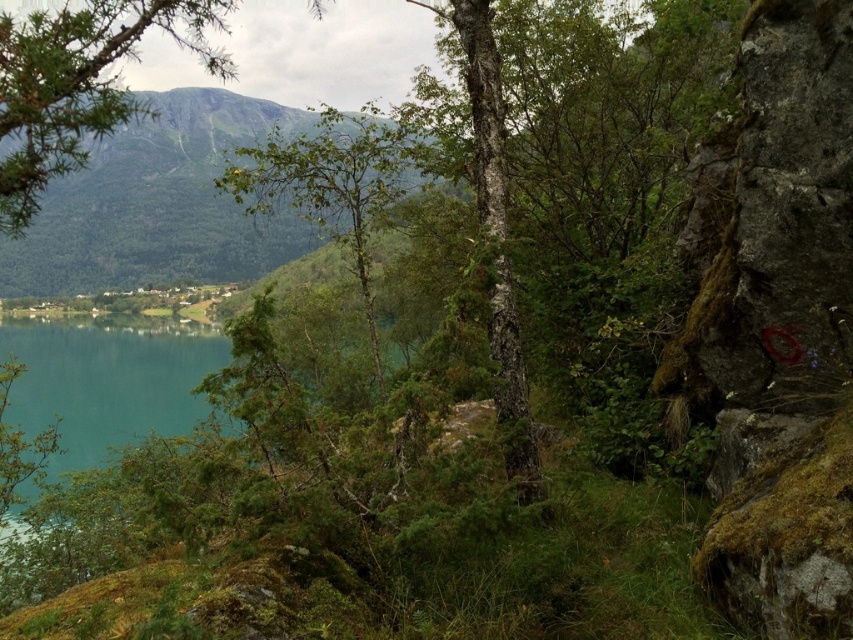
Question: Which point is closer to the camera taking this photo?

Choices:
 (A) (276, 186)
 (B) (112, 272)
 (C) (840, 173)

Answer: (C)

Question: Can you confirm if mossy rock at right is positioned below green leafy tree at center?

Choices:
 (A) no
 (B) yes

Answer: (B)

Question: Which object is closer to the camera taking this photo?

Choices:
 (A) green needle-like leaves at upper left
 (B) green textured mountain at upper left

Answer: (A)

Question: Does green needle-like leaves at upper left have a larger size compared to green leafy tree at center?

Choices:
 (A) yes
 (B) no

Answer: (A)

Question: Can you confirm if mossy rock at right is positioned to the right of green needle-like leaves at upper left?

Choices:
 (A) yes
 (B) no

Answer: (A)

Question: Which of these objects is positioned farthest from the green needle-like leaves at upper left?

Choices:
 (A) green leafy tree at center
 (B) green textured mountain at upper left
 (C) mossy rock at right

Answer: (B)